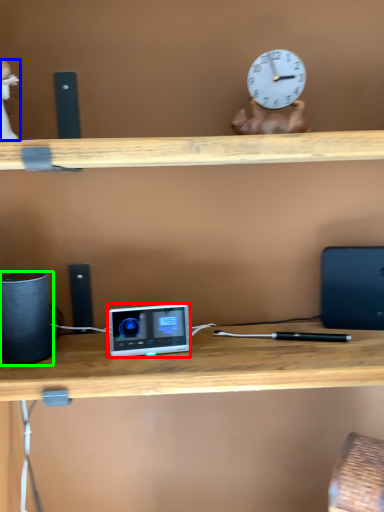
Question: Considering the real-world distances, which object is closest to ipod (highlighted by a red box)? toy (highlighted by a blue box) or speaker (highlighted by a green box).

Choices:
 (A) toy
 (B) speaker

Answer: (B)